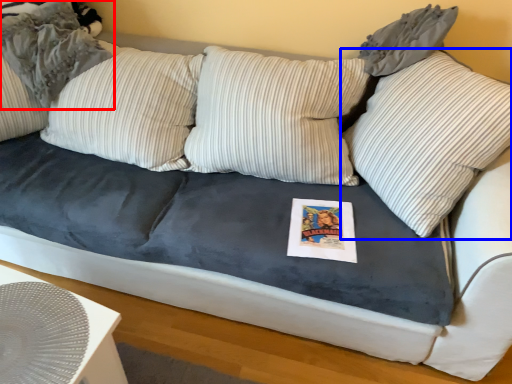
Question: Which of the following is the closest to the observer, pillow (highlighted by a red box) or pillow (highlighted by a blue box)?

Choices:
 (A) pillow
 (B) pillow

Answer: (B)